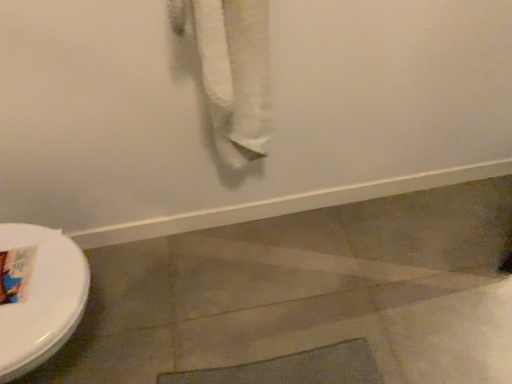
Question: Considering the positions of white cotton towel at upper center and white glossy toilet at left in the image, is white cotton towel at upper center wider or thinner than white glossy toilet at left?

Choices:
 (A) wide
 (B) thin

Answer: (B)

Question: Is point (252, 84) closer or farther from the camera than point (49, 352)?

Choices:
 (A) farther
 (B) closer

Answer: (A)

Question: From a real-world perspective, is white cotton towel at upper center physically located above or below white glossy toilet at left?

Choices:
 (A) above
 (B) below

Answer: (A)

Question: Looking at their shapes, would you say white glossy toilet at left is wider or thinner than white cotton towel at upper center?

Choices:
 (A) thin
 (B) wide

Answer: (B)

Question: Is white glossy toilet at left situated inside white cotton towel at upper center or outside?

Choices:
 (A) outside
 (B) inside

Answer: (A)

Question: Considering the positions of white glossy toilet at left and white cotton towel at upper center in the image, is white glossy toilet at left taller or shorter than white cotton towel at upper center?

Choices:
 (A) tall
 (B) short

Answer: (B)

Question: Looking at the image, does white glossy toilet at left seem bigger or smaller compared to white cotton towel at upper center?

Choices:
 (A) big
 (B) small

Answer: (A)